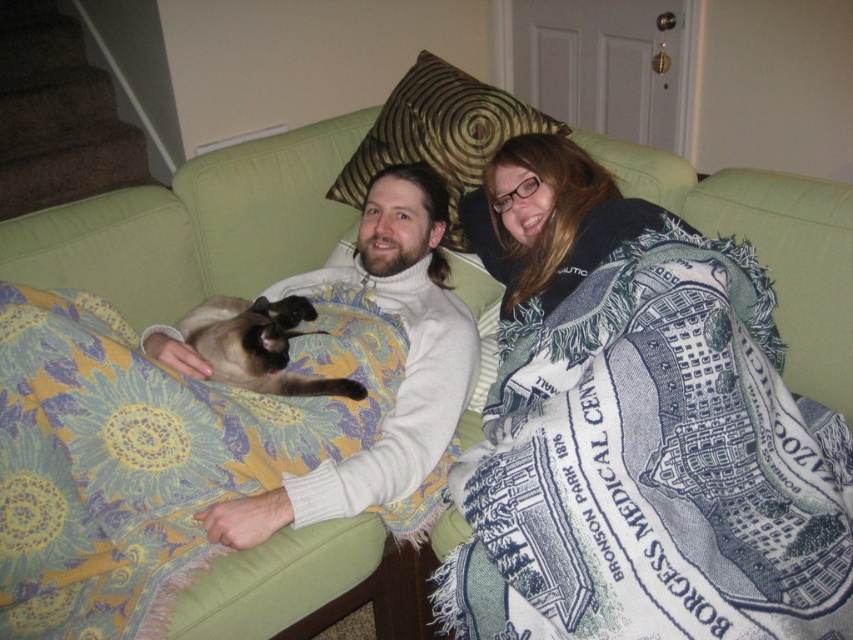
Question: Is the position of blue printed blanket at upper right more distant than that of silky brown fur cat at center?

Choices:
 (A) yes
 (B) no

Answer: (B)

Question: Among these points, which one is nearest to the camera?

Choices:
 (A) (228, 387)
 (B) (207, 348)
 (C) (372, 291)

Answer: (A)

Question: Can you confirm if yellow floral fabric at left is bigger than green velvet pillow at upper center?

Choices:
 (A) no
 (B) yes

Answer: (B)

Question: Does blue printed blanket at upper right have a larger size compared to blue woven blanket at upper right?

Choices:
 (A) no
 (B) yes

Answer: (B)

Question: Which object appears closest to the camera in this image?

Choices:
 (A) green velvet pillow at upper center
 (B) blue printed blanket at upper right

Answer: (B)

Question: Which of the following is the farthest from the observer?

Choices:
 (A) yellow floral fabric at left
 (B) silky brown fur cat at center

Answer: (B)